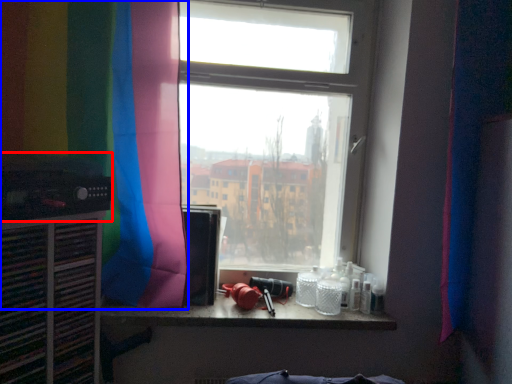
Question: Which object is closer to the camera taking this photo, appliance (highlighted by a red box) or curtain (highlighted by a blue box)?

Choices:
 (A) appliance
 (B) curtain

Answer: (A)